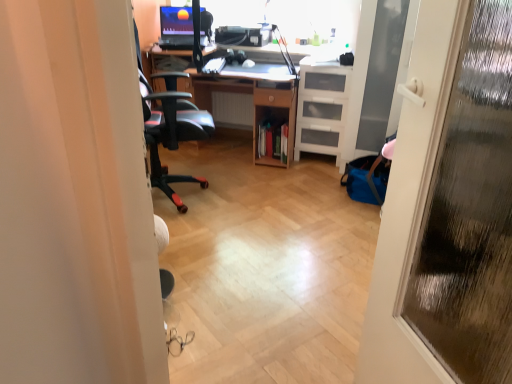
This screenshot has height=384, width=512. I want to click on white plastic radiator at center, so click(232, 110).

Image resolution: width=512 pixels, height=384 pixels. Find the location of `transparent glass screen door at right`. transparent glass screen door at right is located at coordinates (381, 72).

The height and width of the screenshot is (384, 512). Find the location of `wooden desk at center`. wooden desk at center is located at coordinates (245, 90).

What is the approximate height of transparent glass door at right?

1.35 meters.

Find the location of a particular element. This screenshot has height=384, width=512. white plastic radiator at center is located at coordinates (232, 110).

Is white plastic radiator at center positioned far away from matte black monitor at upper center?

That's not correct — white plastic radiator at center is a little close to matte black monitor at upper center.

Who is bigger, white plastic radiator at center or matte black monitor at upper center?

matte black monitor at upper center.

From a real-world perspective, is white plastic radiator at center physically above matte black monitor at upper center?

Incorrect, from a real-world perspective, white plastic radiator at center is lower than matte black monitor at upper center.

Is white plastic radiator at center oriented towards matte black monitor at upper center?

No, white plastic radiator at center is not oriented towards matte black monitor at upper center.

From a real-world perspective, is white plastic drawers at right located beneath transparent glass screen door at right?

Correct, in the physical world, white plastic drawers at right is lower than transparent glass screen door at right.

Is white plastic drawers at right in front of or behind transparent glass screen door at right in the image?

white plastic drawers at right is behind transparent glass screen door at right.

Considering the relative sizes of white plastic drawers at right and transparent glass screen door at right in the image provided, is white plastic drawers at right wider than transparent glass screen door at right?

Incorrect, the width of white plastic drawers at right does not surpass that of transparent glass screen door at right.

From the picture: Can you confirm if white plastic drawers at right is shorter than transparent glass screen door at right?

Yes, white plastic drawers at right is shorter than transparent glass screen door at right.

Looking at their sizes, would you say transparent glass door at right is wider or thinner than transparent glass screen door at right?

In the image, transparent glass door at right appears to be more narrow than transparent glass screen door at right.

Who is taller, transparent glass door at right or transparent glass screen door at right?

transparent glass door at right is taller.

Is transparent glass door at right located outside transparent glass screen door at right?

Indeed, transparent glass door at right is completely outside transparent glass screen door at right.

In terms of size, does transparent glass door at right appear bigger or smaller than transparent glass screen door at right?

In the image, transparent glass door at right appears to be smaller than transparent glass screen door at right.

Does transparent glass screen door at right come in front of white plastic drawers at right?

Yes, transparent glass screen door at right is in front of white plastic drawers at right.

Is transparent glass screen door at right at the right side of white plastic drawers at right?

Correct, you'll find transparent glass screen door at right to the right of white plastic drawers at right.

Is transparent glass screen door at right positioned beyond the bounds of white plastic drawers at right?

Yes.

From the image's perspective, would you say transparent glass screen door at right is shown under white plastic drawers at right?

No, from the image's perspective, transparent glass screen door at right is not beneath white plastic drawers at right.

Between matte black monitor at upper center and transparent glass door at right, which one has smaller width?

transparent glass door at right is thinner.

Can you confirm if matte black monitor at upper center is smaller than transparent glass door at right?

Yes.

Consider the image. Could you tell me if matte black monitor at upper center is facing transparent glass door at right?

Yes, matte black monitor at upper center faces towards transparent glass door at right.

Can you see matte black monitor at upper center touching transparent glass door at right?

matte black monitor at upper center and transparent glass door at right are clearly separated.

Between transparent glass screen door at right and wooden desk at center, which one has smaller width?

transparent glass screen door at right is thinner.

Consider the image. Between transparent glass screen door at right and wooden desk at center, which one is positioned in front?

transparent glass screen door at right.

Which is more to the right, transparent glass screen door at right or wooden desk at center?

Positioned to the right is transparent glass screen door at right.

Choose the correct answer: Is matte black monitor at upper center inside white plastic drawers at right or outside it?

The correct answer is: outside.

Would you say matte black monitor at upper center is a long distance from white plastic drawers at right?

Yes.

Is matte black monitor at upper center turned away from white plastic drawers at right?

No, matte black monitor at upper center is not facing away from white plastic drawers at right.

From a real-world perspective, is matte black monitor at upper center above or below white plastic drawers at right?

Clearly, from a real-world perspective, matte black monitor at upper center is above white plastic drawers at right.

In the image, there is a matte black monitor at upper center. At what (x,y) coordinates should I click in order to perform the action: click on radiator below it (from the image's perspective). Please return your answer as a coordinate pair (x, y). The width and height of the screenshot is (512, 384). Looking at the image, I should click on (232, 110).

Image resolution: width=512 pixels, height=384 pixels. In the image, there is a transparent glass screen door at right. In order to click on cabinetry below it (from a real-world perspective) in this screenshot , I will do `click(321, 106)`.

Estimate the real-world distances between objects in this image. Which object is further from white plastic radiator at center, white plastic drawers at right or wooden desk at center?

white plastic drawers at right lies further to white plastic radiator at center than the other object.

Estimate the real-world distances between objects in this image. Which object is closer to white plastic radiator at center, wooden desk at center or white plastic drawers at right?

wooden desk at center is closer to white plastic radiator at center.

Which object lies nearer to the anchor point transparent glass door at right, white plastic drawers at right or wooden desk at center?

white plastic drawers at right lies closer to transparent glass door at right than the other object.

Which object lies further to the anchor point matte black monitor at upper center, wooden desk at center or transparent glass screen door at right?

The object further to matte black monitor at upper center is transparent glass screen door at right.

From the image, which object appears to be farther from matte black monitor at upper center, white plastic drawers at right or transparent glass door at right?

Among the two, transparent glass door at right is located further to matte black monitor at upper center.

Considering their positions, is white plastic radiator at center positioned closer to transparent glass screen door at right than matte black monitor at upper center?

white plastic radiator at center is closer to transparent glass screen door at right.

From the image, which object appears to be nearer to wooden desk at center, transparent glass door at right or matte black monitor at upper center?

matte black monitor at upper center is positioned closer to the anchor wooden desk at center.

From the picture: From the image, which object appears to be nearer to matte black monitor at upper center, white plastic drawers at right or transparent glass screen door at right?

Answer: Among the two, white plastic drawers at right is located nearer to matte black monitor at upper center.

Locate an element on the screen. This screenshot has width=512, height=384. screen door located between transparent glass door at right and wooden desk at center in the depth direction is located at coordinates (381, 72).

Where is `screen door between transparent glass door at right and white plastic radiator at center along the z-axis`? This screenshot has height=384, width=512. screen door between transparent glass door at right and white plastic radiator at center along the z-axis is located at coordinates (381, 72).

At what (x,y) coordinates should I click in order to perform the action: click on radiator between matte black monitor at upper center and white plastic drawers at right. Please return your answer as a coordinate pair (x, y). Image resolution: width=512 pixels, height=384 pixels. Looking at the image, I should click on (232, 110).

At what (x,y) coordinates should I click in order to perform the action: click on computer desk between transparent glass door at right and matte black monitor at upper center from front to back. Please return your answer as a coordinate pair (x, y). The height and width of the screenshot is (384, 512). Looking at the image, I should click on (245, 90).